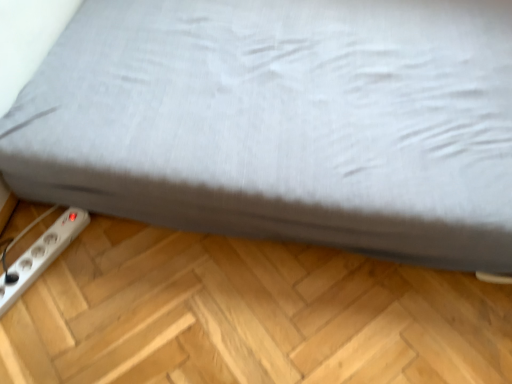
Describe the element at coordinates (282, 123) in the screenshot. I see `gray fabric bed at lower left` at that location.

What is the approximate height of gray fabric bed at lower left?

It is 26.13 centimeters.

Image resolution: width=512 pixels, height=384 pixels. What are the coordinates of `gray fabric bed at lower left` in the screenshot? It's located at (282, 123).

What do you see at coordinates (41, 255) in the screenshot? This screenshot has height=384, width=512. I see `white plastic power plugs and sockets at lower left` at bounding box center [41, 255].

You are a GUI agent. You are given a task and a screenshot of the screen. Output one action in this format:
    pyautogui.click(x=<x>, y=<y>)
    Task: Click on the white plastic power plugs and sockets at lower left
    The height and width of the screenshot is (384, 512).
    Given the screenshot: What is the action you would take?
    pyautogui.click(x=41, y=255)

Measure the distance between point (47,241) and camera.

Point (47,241) and camera are 1.20 meters apart.

What is the approximate height of white plastic power plugs and sockets at lower left?

white plastic power plugs and sockets at lower left is 1.68 inches in height.

Identify the location of gray fabric bed at lower left. The height and width of the screenshot is (384, 512). (282, 123).

Which object is positioned more to the right, gray fabric bed at lower left or white plastic power plugs and sockets at lower left?

gray fabric bed at lower left is more to the right.

Between gray fabric bed at lower left and white plastic power plugs and sockets at lower left, which one is positioned behind?

white plastic power plugs and sockets at lower left is more distant.

Is point (440, 153) closer to camera compared to point (76, 221)?

Yes, it is.

From the image's perspective, is gray fabric bed at lower left below white plastic power plugs and sockets at lower left?

No, from the image's perspective, gray fabric bed at lower left is not beneath white plastic power plugs and sockets at lower left.

From a real-world perspective, is gray fabric bed at lower left located higher than white plastic power plugs and sockets at lower left?

Yes, from a real-world perspective, gray fabric bed at lower left is on top of white plastic power plugs and sockets at lower left.

Considering the relative sizes of gray fabric bed at lower left and white plastic power plugs and sockets at lower left in the image provided, is gray fabric bed at lower left thinner than white plastic power plugs and sockets at lower left?

No.

Which of these two, gray fabric bed at lower left or white plastic power plugs and sockets at lower left, stands taller?

gray fabric bed at lower left is taller.

Is gray fabric bed at lower left bigger than white plastic power plugs and sockets at lower left?

Yes, gray fabric bed at lower left is bigger than white plastic power plugs and sockets at lower left.

Is white plastic power plugs and sockets at lower left completely or partially inside gray fabric bed at lower left?

No, white plastic power plugs and sockets at lower left is not a part of gray fabric bed at lower left.

Is gray fabric bed at lower left not close to white plastic power plugs and sockets at lower left?

No, gray fabric bed at lower left is not far from white plastic power plugs and sockets at lower left.

Is gray fabric bed at lower left aimed at white plastic power plugs and sockets at lower left?

Yes, gray fabric bed at lower left is oriented towards white plastic power plugs and sockets at lower left.

How many degrees apart are the facing directions of gray fabric bed at lower left and white plastic power plugs and sockets at lower left?

69.2 degrees separate the facing orientations of gray fabric bed at lower left and white plastic power plugs and sockets at lower left.

This screenshot has width=512, height=384. Find the location of `bed in front of the white plastic power plugs and sockets at lower left`. bed in front of the white plastic power plugs and sockets at lower left is located at coordinates (282, 123).

Can you confirm if white plastic power plugs and sockets at lower left is positioned to the left of gray fabric bed at lower left?

Yes.

Is white plastic power plugs and sockets at lower left closer to the viewer compared to gray fabric bed at lower left?

No, white plastic power plugs and sockets at lower left is further to the viewer.

Considering the positions of point (61, 222) and point (387, 59), is point (61, 222) closer or farther from the camera than point (387, 59)?

Point (61, 222) appears to be closer to the viewer than point (387, 59).

From the image's perspective, is white plastic power plugs and sockets at lower left located above or below gray fabric bed at lower left?

white plastic power plugs and sockets at lower left is situated lower than gray fabric bed at lower left in the image.

From a real-world perspective, is white plastic power plugs and sockets at lower left located higher than gray fabric bed at lower left?

Actually, white plastic power plugs and sockets at lower left is physically below gray fabric bed at lower left in the real world.

Which of these two, white plastic power plugs and sockets at lower left or gray fabric bed at lower left, is wider?

Wider between the two is gray fabric bed at lower left.

Can you confirm if white plastic power plugs and sockets at lower left is shorter than gray fabric bed at lower left?

Yes.

Based on the photo, considering the sizes of objects white plastic power plugs and sockets at lower left and gray fabric bed at lower left in the image provided, who is smaller, white plastic power plugs and sockets at lower left or gray fabric bed at lower left?

With smaller size is white plastic power plugs and sockets at lower left.

Can gray fabric bed at lower left be found inside white plastic power plugs and sockets at lower left?

No, gray fabric bed at lower left is not inside white plastic power plugs and sockets at lower left.

Is white plastic power plugs and sockets at lower left beside gray fabric bed at lower left?

No, white plastic power plugs and sockets at lower left is not touching gray fabric bed at lower left.

Could you tell me if white plastic power plugs and sockets at lower left is facing gray fabric bed at lower left?

No, white plastic power plugs and sockets at lower left is not facing towards gray fabric bed at lower left.

Can you tell me how much white plastic power plugs and sockets at lower left and gray fabric bed at lower left differ in facing direction?

They differ by 69.2 degrees in their facing directions.

Where is `power plugs and sockets that is on the left side of gray fabric bed at lower left`? power plugs and sockets that is on the left side of gray fabric bed at lower left is located at coordinates (41, 255).

In the image, there is a white plastic power plugs and sockets at lower left. At what (x,y) coordinates should I click in order to perform the action: click on bed above it (from the image's perspective). Please return your answer as a coordinate pair (x, y). The width and height of the screenshot is (512, 384). Looking at the image, I should click on (282, 123).

In order to click on bed located on the right of white plastic power plugs and sockets at lower left in this screenshot , I will do `click(282, 123)`.